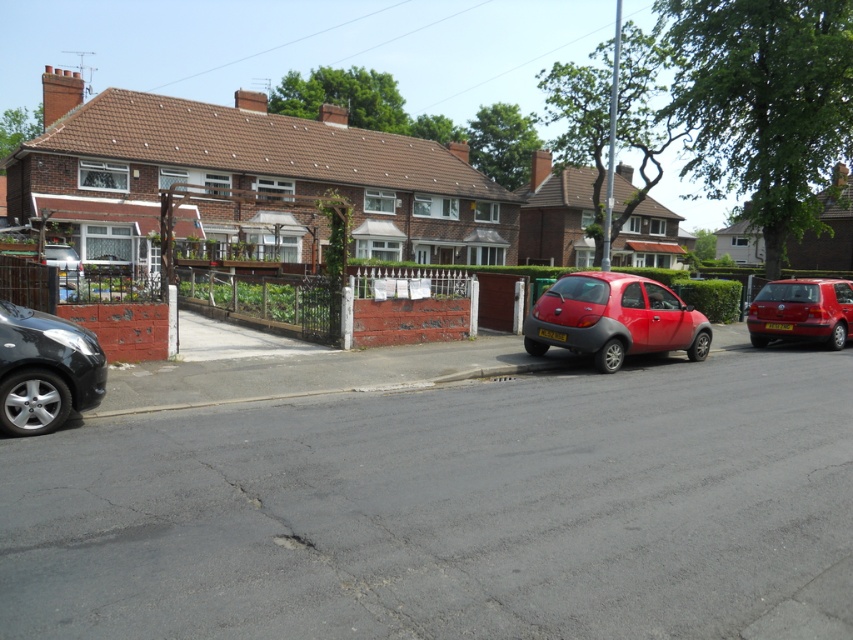
Is point (683, 314) positioned before point (77, 356)?

That is False.

The width and height of the screenshot is (853, 640). I want to click on shiny red car at center, so click(613, 320).

This screenshot has height=640, width=853. I want to click on shiny red car at center, so (x=613, y=320).

Measure the distance from shiny red car at center to metallic silver car at center.

shiny red car at center is 33.48 feet away from metallic silver car at center.

Where is `shiny red car at center`? This screenshot has width=853, height=640. shiny red car at center is located at coordinates click(613, 320).

Is point (633, 284) less distant than point (51, 256)?

That is True.

Identify the location of shiny red car at center. (613, 320).

Who is lower down, shiny black car at lower left or metallic silver car at center?

shiny black car at lower left is below.

Does point (48, 328) come behind point (74, 252)?

No, it is not.

Image resolution: width=853 pixels, height=640 pixels. Identify the location of shiny black car at lower left. (45, 371).